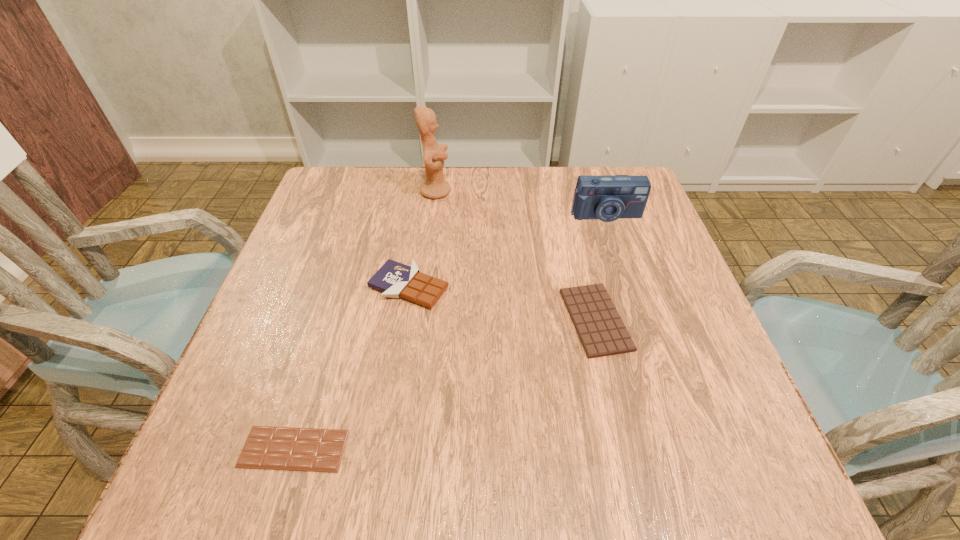
The height and width of the screenshot is (540, 960). I want to click on vacant area between the tallest object and the tallest chocolate bar, so click(422, 239).

At what (x,y) coordinates should I click in order to perform the action: click on vacant area between the rightmost chocolate bar and the figurine. Please return your answer as a coordinate pair (x, y). Image resolution: width=960 pixels, height=540 pixels. Looking at the image, I should click on (516, 255).

You are a GUI agent. You are given a task and a screenshot of the screen. Output one action in this format:
    pyautogui.click(x=<x>, y=<y>)
    Task: Click on the empty location between the second shortest object and the shortest object
    
    Given the screenshot: What is the action you would take?
    pyautogui.click(x=444, y=384)

Where is `vacant point located between the second tallest object and the tallest object`? The width and height of the screenshot is (960, 540). vacant point located between the second tallest object and the tallest object is located at coordinates (520, 203).

Image resolution: width=960 pixels, height=540 pixels. Identify the location of empty space between the rightmost chocolate bar and the nearest chocolate bar. (444, 384).

This screenshot has width=960, height=540. Find the location of `empty space that is in between the third shortest object and the camera`. empty space that is in between the third shortest object and the camera is located at coordinates (507, 251).

At what (x,y) coordinates should I click in order to perform the action: click on free space between the shortest chocolate bar and the farthest object. Please return your answer as a coordinate pair (x, y). The image size is (960, 540). Looking at the image, I should click on (365, 320).

Point out which object is positioned as the nearest to the camera. Please provide its 2D coordinates. Your answer should be formatted as a tuple, i.e. [(x, y)], where the tuple contains the x and y coordinates of a point satisfying the conditions above.

[(597, 322)]

Locate an element on the screen. The width and height of the screenshot is (960, 540). the third closest object to the shortest object is located at coordinates (434, 187).

Image resolution: width=960 pixels, height=540 pixels. What are the coordinates of `chocolate bar identified as the third closest to the farthest object` in the screenshot? It's located at (275, 448).